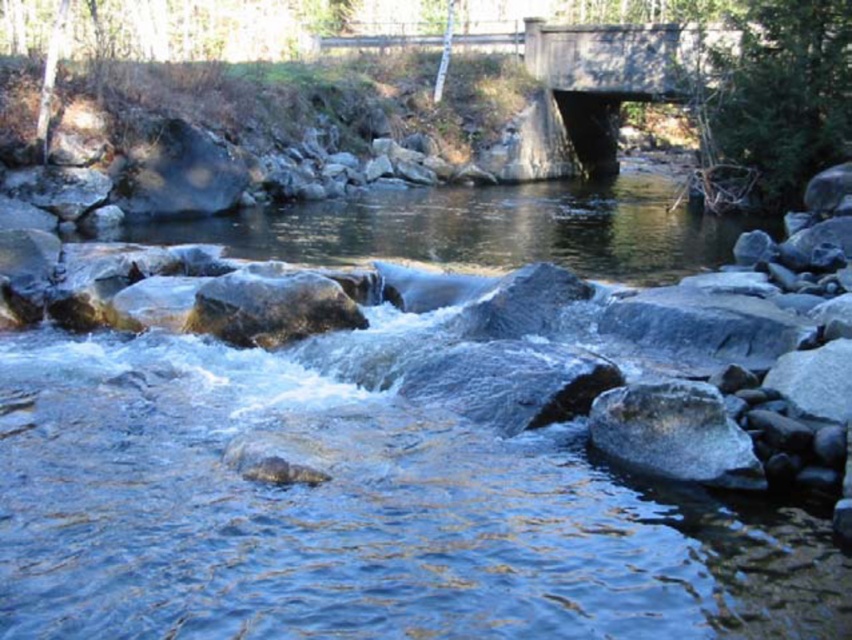
Question: Which point is farther from the camera taking this photo?

Choices:
 (A) (715, 403)
 (B) (706, 259)

Answer: (B)

Question: Among these points, which one is nearest to the camera?

Choices:
 (A) 635,422
 (B) 612,214

Answer: (A)

Question: Considering the relative positions of smooth gray rocks at center and smooth gray rock at center in the image provided, where is smooth gray rocks at center located with respect to smooth gray rock at center?

Choices:
 (A) above
 (B) below

Answer: (A)

Question: Considering the relative positions of smooth gray rocks at center and smooth gray rock at center in the image provided, where is smooth gray rocks at center located with respect to smooth gray rock at center?

Choices:
 (A) above
 (B) below

Answer: (A)

Question: Where is smooth gray rocks at center located in relation to smooth gray rock at center in the image?

Choices:
 (A) right
 (B) left

Answer: (A)